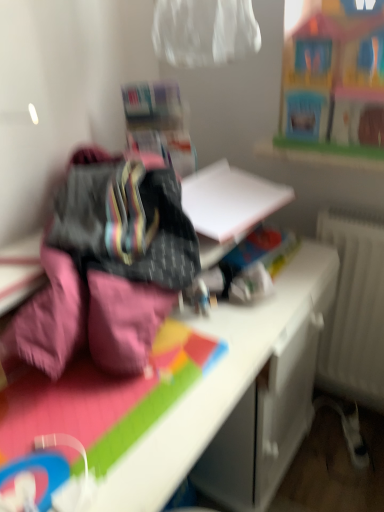
Question: Is wooden toy house at upper right completely or partially inside pink fabric at left?

Choices:
 (A) no
 (B) yes

Answer: (A)

Question: From the image's perspective, does pink fabric at left appear higher than wooden toy house at upper right?

Choices:
 (A) no
 (B) yes

Answer: (A)

Question: From a real-world perspective, is pink fabric at left over wooden toy house at upper right?

Choices:
 (A) no
 (B) yes

Answer: (A)

Question: Can you confirm if pink fabric at left is wider than wooden toy house at upper right?

Choices:
 (A) yes
 (B) no

Answer: (A)

Question: From the image's perspective, is pink fabric at left located beneath wooden toy house at upper right?

Choices:
 (A) no
 (B) yes

Answer: (B)

Question: From the image's perspective, is wooden toy house at upper right above or below pink fabric at left?

Choices:
 (A) below
 (B) above

Answer: (B)

Question: From their relative heights in the image, would you say wooden toy house at upper right is taller or shorter than pink fabric at left?

Choices:
 (A) short
 (B) tall

Answer: (A)

Question: From a real-world perspective, relative to pink fabric at left, is wooden toy house at upper right vertically above or below?

Choices:
 (A) above
 (B) below

Answer: (A)

Question: Considering the positions of wooden toy house at upper right and pink fabric at left in the image, is wooden toy house at upper right wider or thinner than pink fabric at left?

Choices:
 (A) thin
 (B) wide

Answer: (A)

Question: Visually, is pink fabric at left positioned to the left or to the right of white glossy desk at center?

Choices:
 (A) right
 (B) left

Answer: (B)

Question: Is pink fabric at left inside or outside of white glossy desk at center?

Choices:
 (A) inside
 (B) outside

Answer: (B)

Question: In the image, is pink fabric at left positioned in front of or behind white glossy desk at center?

Choices:
 (A) front
 (B) behind

Answer: (B)

Question: From a real-world perspective, relative to white glossy desk at center, is pink fabric at left vertically above or below?

Choices:
 (A) below
 (B) above

Answer: (B)

Question: Looking at the image, does pink fabric at left seem bigger or smaller compared to wooden toy house at upper right?

Choices:
 (A) big
 (B) small

Answer: (A)

Question: From the image's perspective, is pink fabric at left positioned above or below wooden toy house at upper right?

Choices:
 (A) below
 (B) above

Answer: (A)